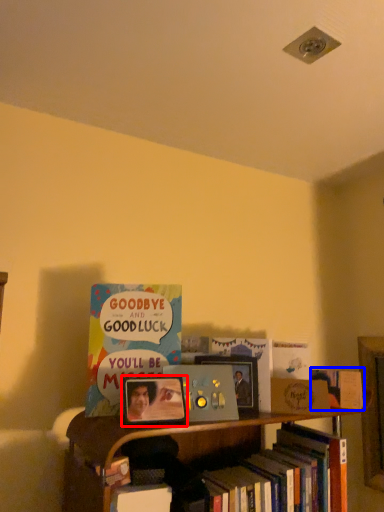
Question: Which object is closer to the camera taking this photo, picture frame (highlighted by a red box) or book (highlighted by a blue box)?

Choices:
 (A) picture frame
 (B) book

Answer: (A)